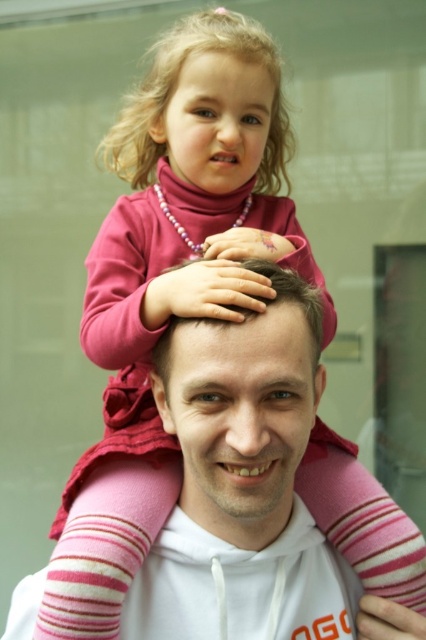
Is pink fleece jacket at upper center positioned before pink fabric head at center?

That is False.

Locate an element on the screen. The width and height of the screenshot is (426, 640). pink fleece jacket at upper center is located at coordinates [x=189, y=202].